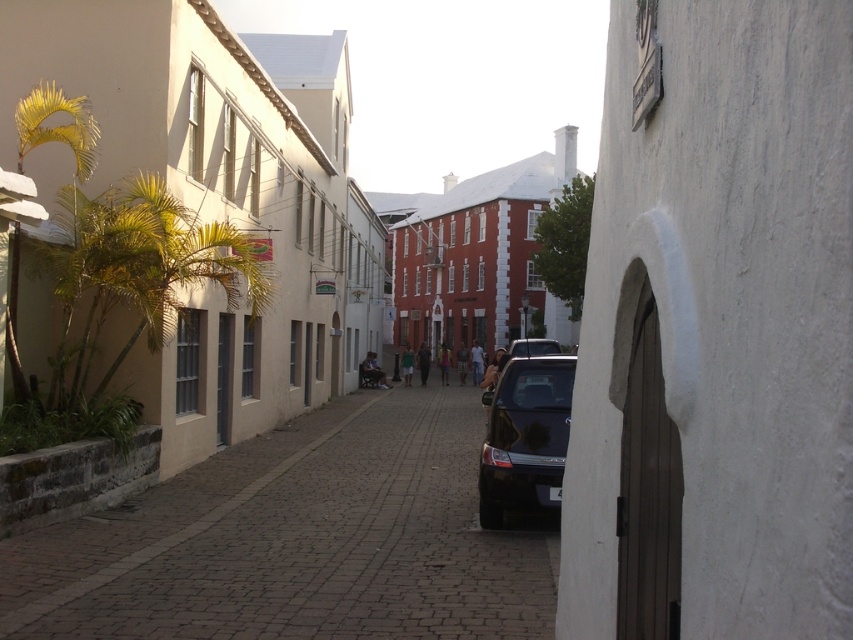
What is the 2D coordinate of the brown cobblestone street at center?

The brown cobblestone street at center is located at the 2D coordinate point of (299, 540).

You are a delivery driver who needs to park your shiny dark blue car at center in a spot that can accommodate its size. Given the brown cobblestone street at center is larger than the car, can you safely park your car there?

The brown cobblestone street at center is larger in size than the shiny dark blue car at center, so yes, you can safely park your shiny dark blue car at center there as there is enough space.

You are a delivery driver who needs to park your shiny dark blue car at center on the right side of the brown cobblestone street at center. Is there enough space to park it there?

The brown cobblestone street at center is positioned on the left side of the shiny dark blue car at center, so the car is already on the right side of the street. Therefore, there is enough space to park the shiny dark blue car at center there.